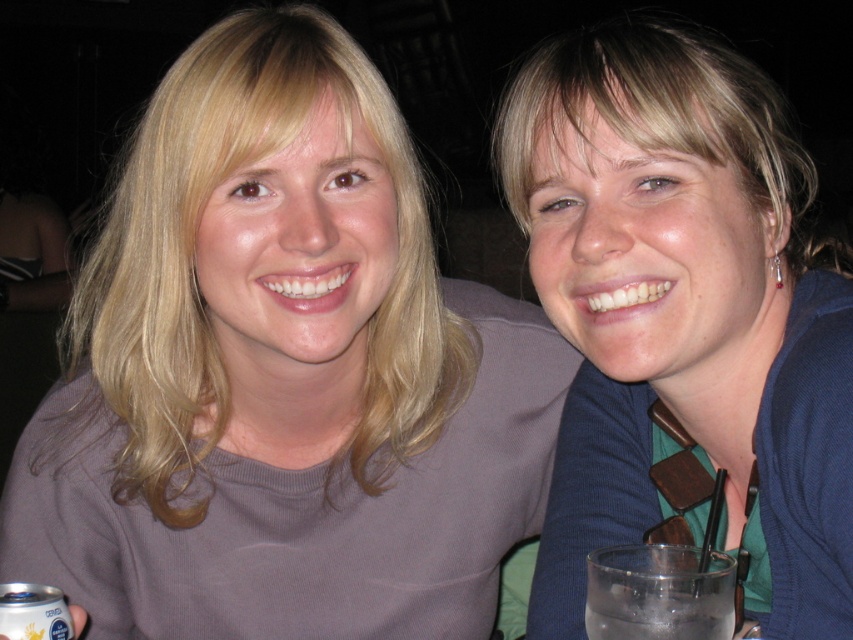
Is matte gray sweater at upper left further to the viewer compared to clear glass at lower right?

That is True.

Is matte gray sweater at upper left positioned before clear glass at lower right?

That is False.

This screenshot has height=640, width=853. What are the coordinates of `matte gray sweater at upper left` in the screenshot? It's located at (281, 372).

The image size is (853, 640). What are the coordinates of `matte gray sweater at upper left` in the screenshot? It's located at [281, 372].

Is matte gray sweater at upper left positioned at the back of blue fabric shirt at upper right?

Yes, matte gray sweater at upper left is further from the viewer.

Which is more to the right, matte gray sweater at upper left or blue fabric shirt at upper right?

From the viewer's perspective, blue fabric shirt at upper right appears more on the right side.

Which is behind, point (184, 64) or point (796, 412)?

Point (184, 64)

This screenshot has width=853, height=640. I want to click on matte gray sweater at upper left, so click(x=281, y=372).

Between blue fabric shirt at upper right and clear glass at lower right, which one appears on the left side from the viewer's perspective?

clear glass at lower right

Does point (639, 465) come closer to viewer compared to point (700, 611)?

That is False.

Where is `blue fabric shirt at upper right`? blue fabric shirt at upper right is located at coordinates (683, 317).